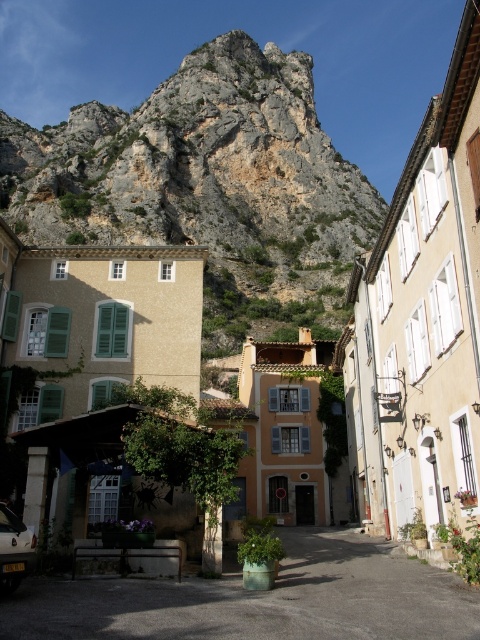
Question: Is rocky cliff at upper center above green concrete planter at center?

Choices:
 (A) no
 (B) yes

Answer: (B)

Question: Does rocky cliff at upper center have a greater width compared to green concrete planter at center?

Choices:
 (A) no
 (B) yes

Answer: (B)

Question: Among these objects, which one is nearest to the camera?

Choices:
 (A) rocky cliff at upper center
 (B) green concrete planter at center

Answer: (B)

Question: In this image, where is rocky cliff at upper center located relative to green concrete planter at center?

Choices:
 (A) right
 (B) left

Answer: (B)